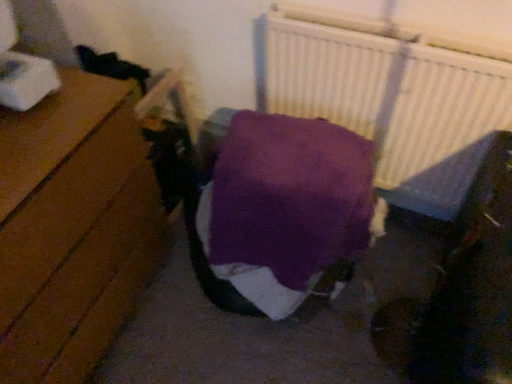
Question: Is purple soft blanket at center oriented towards white textured radiator at upper right?

Choices:
 (A) no
 (B) yes

Answer: (A)

Question: Can you confirm if purple soft blanket at center is taller than white textured radiator at upper right?

Choices:
 (A) no
 (B) yes

Answer: (A)

Question: Can you confirm if purple soft blanket at center is positioned to the right of white textured radiator at upper right?

Choices:
 (A) yes
 (B) no

Answer: (B)

Question: Is white textured radiator at upper right at the back of purple soft blanket at center?

Choices:
 (A) no
 (B) yes

Answer: (B)

Question: Are purple soft blanket at center and white textured radiator at upper right located far from each other?

Choices:
 (A) yes
 (B) no

Answer: (B)

Question: In terms of size, does wooden floor at left appear bigger or smaller than white textured radiator at upper right?

Choices:
 (A) small
 (B) big

Answer: (B)

Question: Is wooden floor at left taller or shorter than white textured radiator at upper right?

Choices:
 (A) tall
 (B) short

Answer: (A)

Question: From the image's perspective, is wooden floor at left located above or below white textured radiator at upper right?

Choices:
 (A) above
 (B) below

Answer: (B)

Question: Would you say wooden floor at left is to the left or to the right of white textured radiator at upper right in the picture?

Choices:
 (A) left
 (B) right

Answer: (A)

Question: From a real-world perspective, relative to wooden floor at left, is white textured radiator at upper right vertically above or below?

Choices:
 (A) above
 (B) below

Answer: (A)

Question: In terms of height, does white textured radiator at upper right look taller or shorter compared to wooden floor at left?

Choices:
 (A) tall
 (B) short

Answer: (B)

Question: In terms of size, does white textured radiator at upper right appear bigger or smaller than wooden floor at left?

Choices:
 (A) big
 (B) small

Answer: (B)

Question: Is point (303, 44) positioned closer to the camera than point (89, 79)?

Choices:
 (A) farther
 (B) closer

Answer: (A)

Question: Is white textured radiator at upper right wider or thinner than purple soft blanket at center?

Choices:
 (A) wide
 (B) thin

Answer: (B)

Question: From the image's perspective, is white textured radiator at upper right located above or below purple soft blanket at center?

Choices:
 (A) above
 (B) below

Answer: (A)